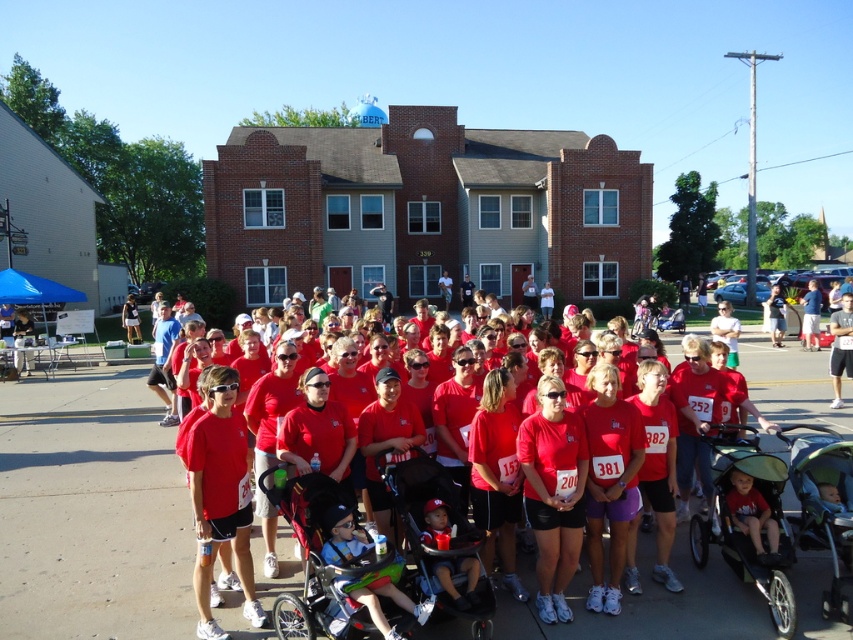
Question: Which point appears farthest from the camera in this image?

Choices:
 (A) (584, 620)
 (B) (293, 493)

Answer: (A)

Question: Can you confirm if matte black stroller at center is thinner than matte red shirt at center?

Choices:
 (A) yes
 (B) no

Answer: (B)

Question: Does matte black stroller at center have a larger size compared to matte red shirt at center?

Choices:
 (A) no
 (B) yes

Answer: (B)

Question: Does matte black stroller at center come behind matte red shirt at center?

Choices:
 (A) no
 (B) yes

Answer: (A)

Question: Which point is farther to the camera?

Choices:
 (A) matte black stroller at center
 (B) matte red shirt at center

Answer: (B)